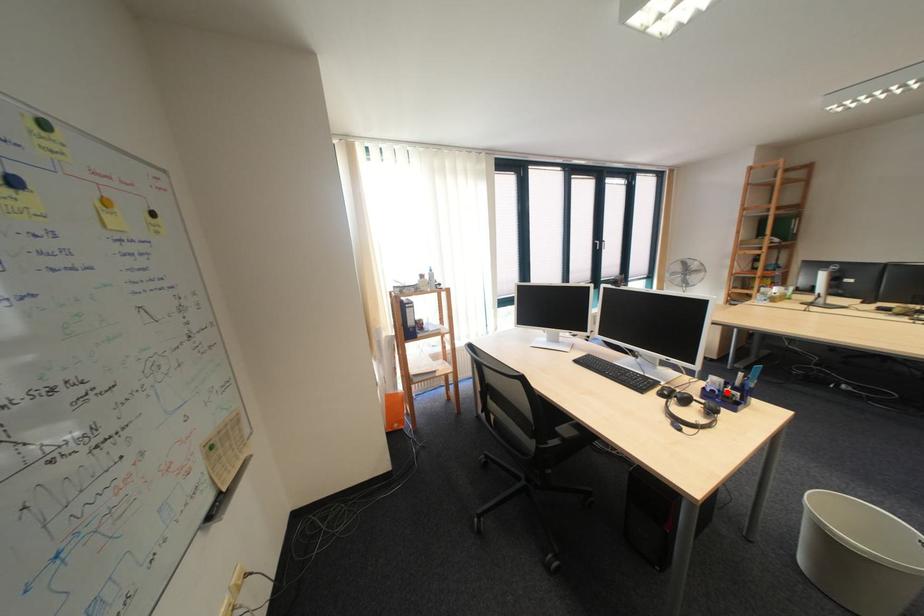
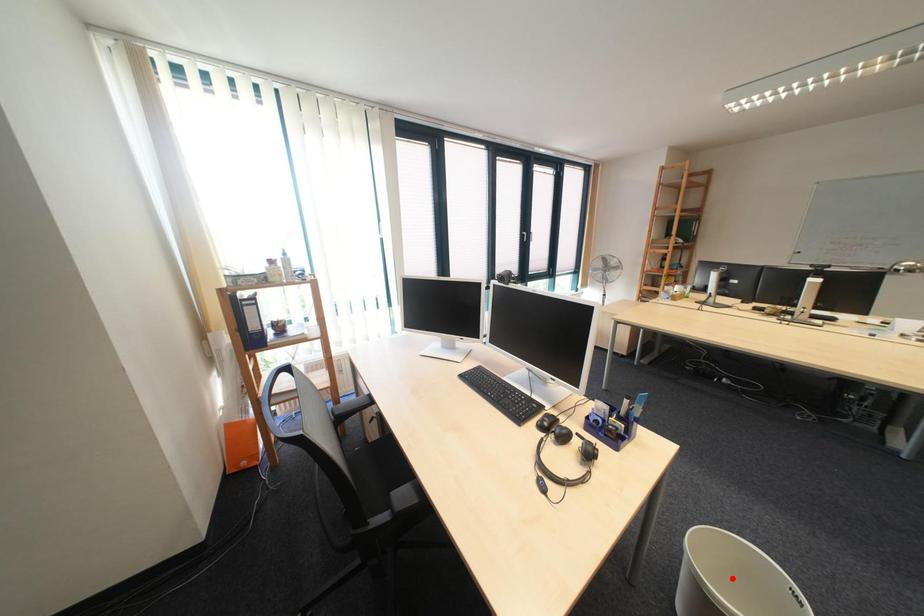
I am providing you with two images of the same scene from different viewpoints. A red point is marked on the first image and another point is marked on the second image. Is the marked point in image1 the same physical position as the marked point in image2?

No